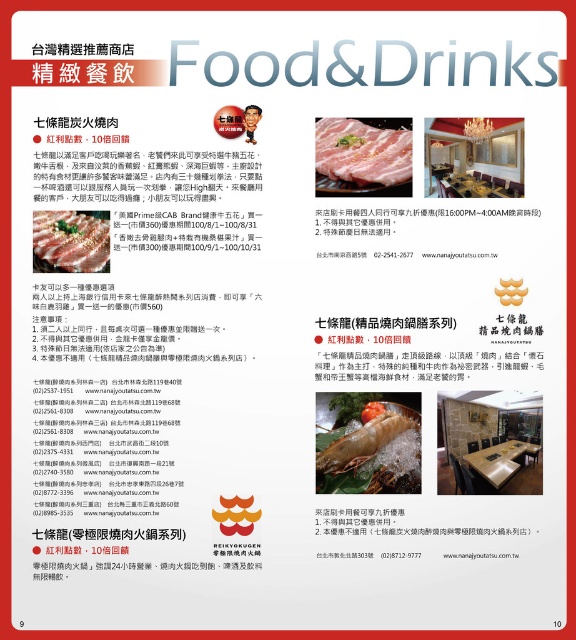
Question: Is matte black table at center thinner than pinkish-white meat at center?

Choices:
 (A) yes
 (B) no

Answer: (A)

Question: Can you confirm if matte black table at center is positioned above matte black pork belly at center?

Choices:
 (A) no
 (B) yes

Answer: (B)

Question: Which object is the closest to the matte black table at center?

Choices:
 (A) pinkish-white meat at center
 (B) matte black pork belly at center
 (C) white glossy prawns at center

Answer: (A)

Question: Which object is closer to the camera taking this photo?

Choices:
 (A) pinkish-white meat at center
 (B) matte black pork belly at center
 (C) matte black table at center

Answer: (B)

Question: Does white glossy prawns at center have a smaller size compared to matte black pork belly at center?

Choices:
 (A) no
 (B) yes

Answer: (A)

Question: Which point is closer to the camera taking this photo?

Choices:
 (A) (396, 483)
 (B) (348, 145)
 (C) (469, 116)
 (D) (43, 257)

Answer: (D)